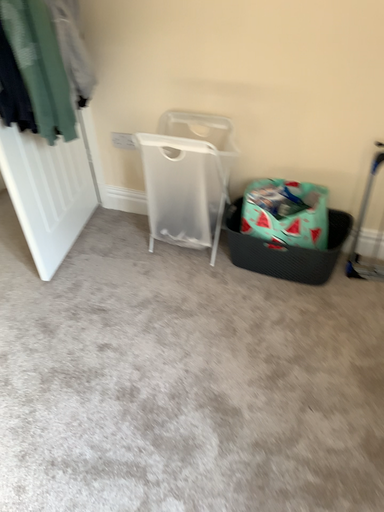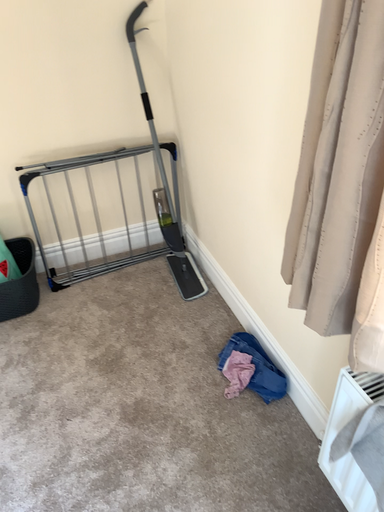
Question: How did the camera likely rotate when shooting the video?

Choices:
 (A) rotated downward
 (B) rotated upward

Answer: (B)